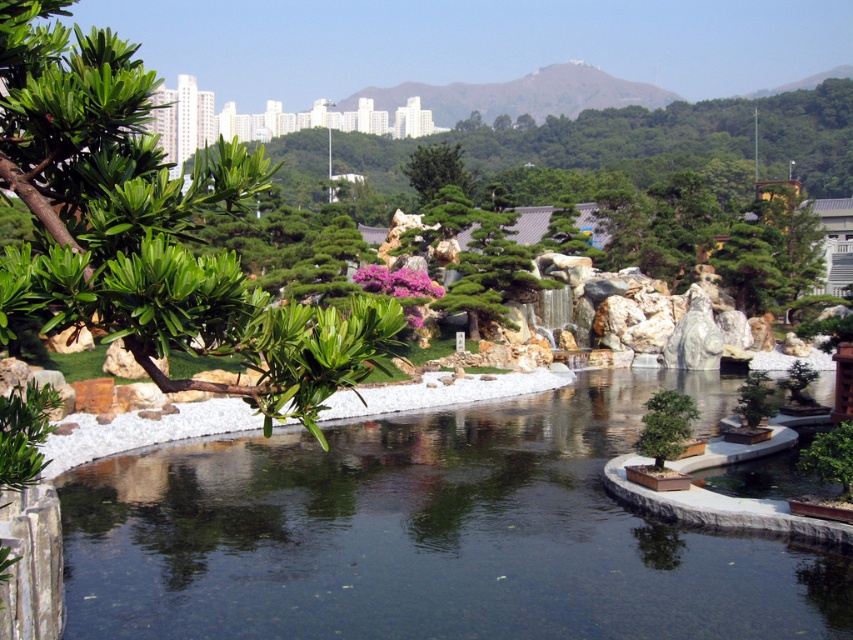
Question: Which point is closer to the camera taking this photo?

Choices:
 (A) (70, 300)
 (B) (497, 477)
 (C) (421, 173)

Answer: (A)

Question: Which object is farther from the camera taking this photo?

Choices:
 (A) green textured tree at center
 (B) green leafy branch at left

Answer: (A)

Question: Is clear water at center further to the viewer compared to green textured tree at center?

Choices:
 (A) yes
 (B) no

Answer: (B)

Question: Which object appears farthest from the camera in this image?

Choices:
 (A) clear water at center
 (B) green textured tree at center

Answer: (B)

Question: Is clear water at center smaller than green textured tree at center?

Choices:
 (A) yes
 (B) no

Answer: (A)

Question: Is green leafy branch at left bigger than green textured tree at center?

Choices:
 (A) no
 (B) yes

Answer: (A)